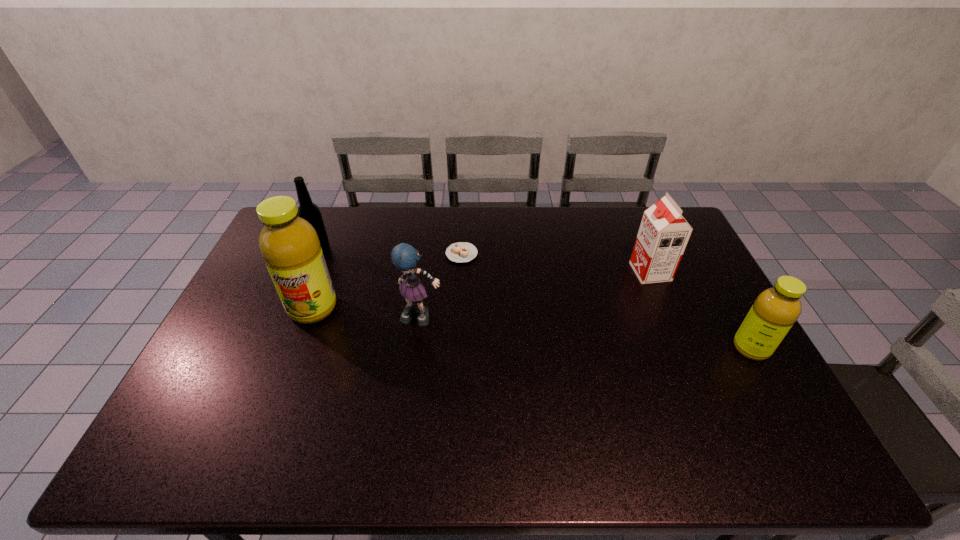
Where is `the left fruit juice`? the left fruit juice is located at coordinates (289, 245).

I want to click on the farther fruit juice, so click(x=289, y=245).

The width and height of the screenshot is (960, 540). In order to click on the nearer fruit juice in this screenshot , I will do `click(775, 310)`.

What are the coordinates of `the right fruit juice` in the screenshot? It's located at (775, 310).

Where is `soya milk`? soya milk is located at coordinates (663, 234).

Locate an element on the screen. beer bottle is located at coordinates (308, 210).

I want to click on rag doll, so click(x=405, y=257).

At what (x,y) coordinates should I click in order to perform the action: click on the shortest object. Please return your answer as a coordinate pair (x, y). Image resolution: width=960 pixels, height=540 pixels. Looking at the image, I should click on (459, 252).

Where is `vacant space located 0.050m on the front label of the taller fruit juice`? vacant space located 0.050m on the front label of the taller fruit juice is located at coordinates (300, 340).

Image resolution: width=960 pixels, height=540 pixels. What are the coordinates of `vacant space located on the left of the soya milk` in the screenshot? It's located at (525, 272).